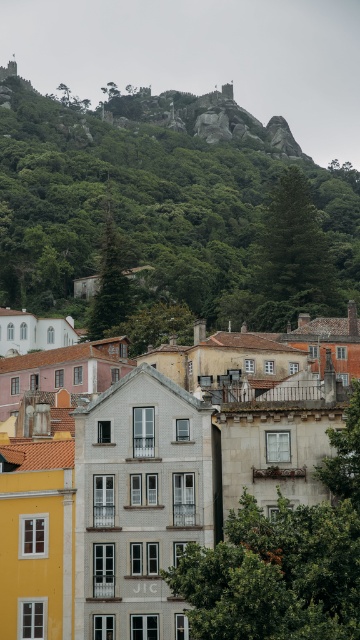
You are a tourist standing at the base of the hillside town. You see the white tile building at center and the green leafy hillside at upper center. Which object is positioned higher up the slope?

The green leafy hillside at upper center is positioned higher up the slope than the white tile building at center.

You are standing at the base of the hillside town and want to take a photo that includes both the white tile building at center and the green leafy hillside at upper center. Based on their positions, which object should you frame first in your camera viewfinder to ensure both are in the shot?

You should frame the white tile building at center first since it is closer to the viewer than the green leafy hillside at upper center, ensuring both are included in the photo.

You are a drone operator planning to capture aerial footage of the white tile building at center and the green leafy hillside at upper center. What is the minimum distance your drone needs to travel to film both locations?

The minimum distance the drone needs to travel is 91.62 meters between the white tile building at center and the green leafy hillside at upper center.